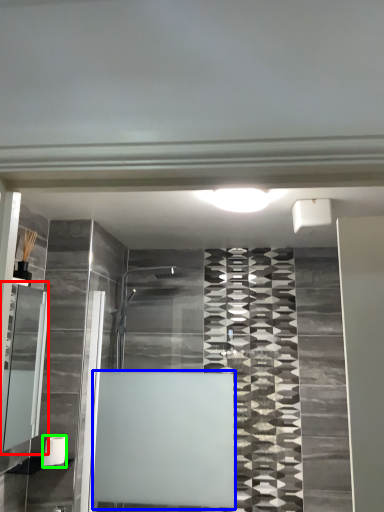
Question: Estimate the real-world distances between objects in this image. Which object is closer to cabinet (highlighted by a red box), bath (highlighted by a blue box) or toilet paper (highlighted by a green box)?

Choices:
 (A) bath
 (B) toilet paper

Answer: (B)